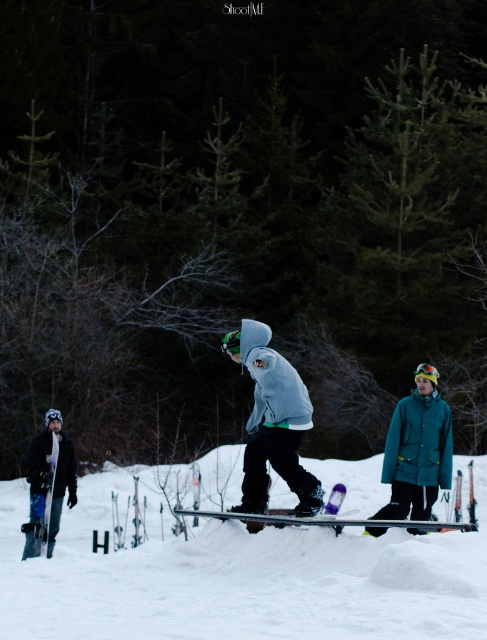
Question: Is white fluffy snow at center thinner than matte purple snowboard at lower left?

Choices:
 (A) yes
 (B) no

Answer: (B)

Question: Which point is closer to the camera taking this photo?

Choices:
 (A) (265, 486)
 (B) (248, 518)

Answer: (B)

Question: Which point is closer to the camera?

Choices:
 (A) white fluffy snow at center
 (B) matte gray hoodie at center

Answer: (A)

Question: Does white fluffy snow at center have a greater width compared to matte purple snowboard at lower left?

Choices:
 (A) yes
 (B) no

Answer: (A)

Question: Does matte purple snowboard at lower left appear on the left side of black matte snowboard at center?

Choices:
 (A) yes
 (B) no

Answer: (A)

Question: Which object is closer to the camera taking this photo?

Choices:
 (A) black matte snowboard at center
 (B) white fluffy snow at center

Answer: (B)